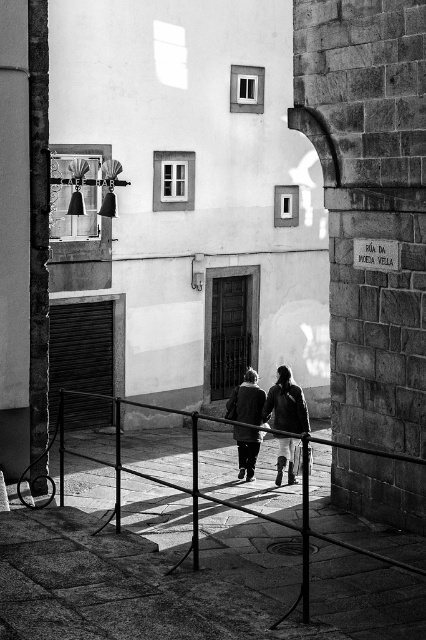
Question: Estimate the real-world distances between objects in this image. Which object is farther from the smooth metal railing at center?

Choices:
 (A) dark gray coat at center
 (B) dark gray fabric coat at center

Answer: (A)

Question: Among these objects, which one is nearest to the camera?

Choices:
 (A) dark gray coat at center
 (B) smooth metal railing at center

Answer: (B)

Question: Is smooth metal railing at center to the left of dark gray fabric coat at center from the viewer's perspective?

Choices:
 (A) no
 (B) yes

Answer: (B)

Question: Does smooth metal railing at center appear on the right side of dark gray fabric coat at center?

Choices:
 (A) no
 (B) yes

Answer: (A)

Question: Is dark gray fabric coat at center further to camera compared to dark gray coat at center?

Choices:
 (A) yes
 (B) no

Answer: (B)

Question: Among these points, which one is farthest from the camera?

Choices:
 (A) (229, 400)
 (B) (233, 433)

Answer: (B)